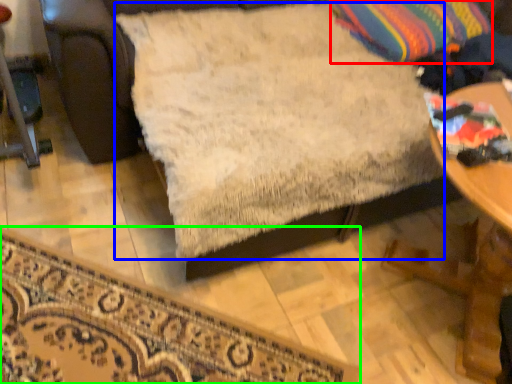
Question: Which object is the farthest from throw pillow (highlighted by a red box)? Choose among these: sheet (highlighted by a blue box) or furniture (highlighted by a green box).

Choices:
 (A) sheet
 (B) furniture

Answer: (B)